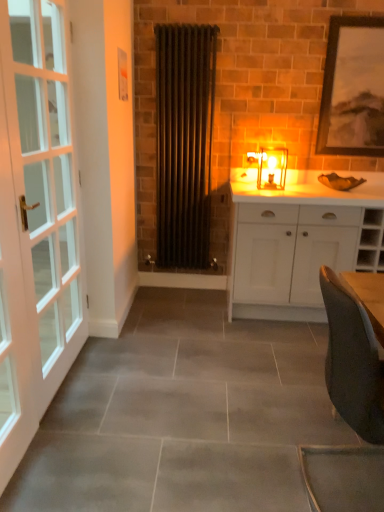
Question: Is matte glass candlestick at center smaller than white glass door at left?

Choices:
 (A) yes
 (B) no

Answer: (A)

Question: Considering the relative sizes of matte glass candlestick at center and white glass door at left in the image provided, is matte glass candlestick at center thinner than white glass door at left?

Choices:
 (A) yes
 (B) no

Answer: (B)

Question: Is matte glass candlestick at center positioned behind white glass door at left?

Choices:
 (A) no
 (B) yes

Answer: (B)

Question: Can you confirm if matte glass candlestick at center is positioned to the right of white glass door at left?

Choices:
 (A) yes
 (B) no

Answer: (A)

Question: Can you confirm if matte glass candlestick at center is shorter than white glass door at left?

Choices:
 (A) no
 (B) yes

Answer: (B)

Question: From a real-world perspective, is matte glass candlestick at center below white glass door at left?

Choices:
 (A) yes
 (B) no

Answer: (B)

Question: From a real-world perspective, is white matte cabinet at center located higher than white glass door at left?

Choices:
 (A) yes
 (B) no

Answer: (B)

Question: Is white glass door at left located within white matte cabinet at center?

Choices:
 (A) yes
 (B) no

Answer: (B)

Question: Is white matte cabinet at center with white glass door at left?

Choices:
 (A) yes
 (B) no

Answer: (B)

Question: Can you confirm if white matte cabinet at center is bigger than white glass door at left?

Choices:
 (A) yes
 (B) no

Answer: (A)

Question: Is white matte cabinet at center oriented towards white glass door at left?

Choices:
 (A) no
 (B) yes

Answer: (A)

Question: Considering the relative positions of white matte cabinet at center and white glass door at left in the image provided, is white matte cabinet at center to the right of white glass door at left from the viewer's perspective?

Choices:
 (A) no
 (B) yes

Answer: (B)

Question: Is matte glass candlestick at center shorter than white matte cabinet at center?

Choices:
 (A) no
 (B) yes

Answer: (B)